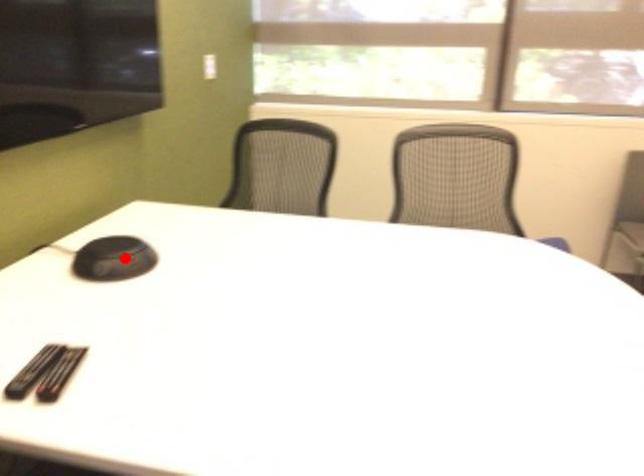
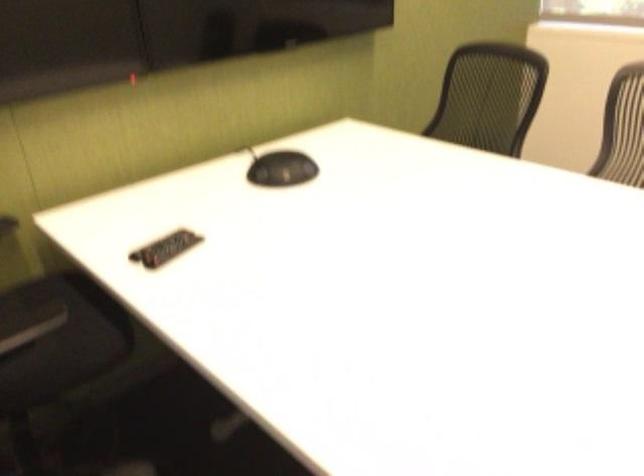
Where in the second image is the point corresponding to the highlighted location from the first image?

(281, 169)